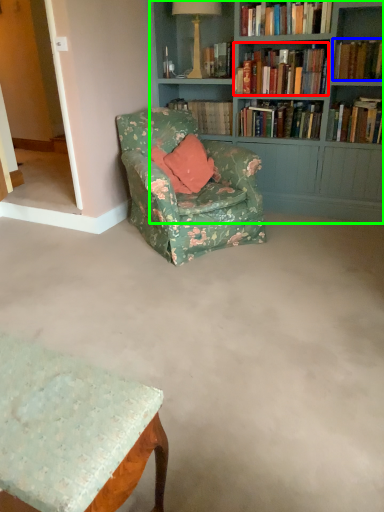
Question: Which object is positioned closest to book (highlighted by a red box)? Select from book (highlighted by a blue box) and bookcase (highlighted by a green box).

Choices:
 (A) book
 (B) bookcase

Answer: (B)